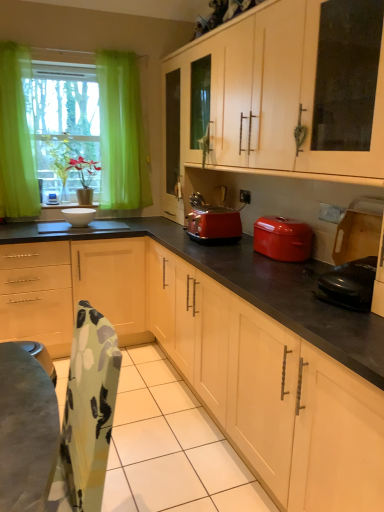
Question: In terms of height, does white glossy bowl at center, which is counted as the 1th appliance, starting from the back, look taller or shorter compared to white matte cabinet at upper center, which appears as the 1th cabinetry when viewed from the top?

Choices:
 (A) tall
 (B) short

Answer: (B)

Question: In the image, is white glossy bowl at center, which is counted as the 1th appliance, starting from the back, on the left side or the right side of white matte cabinet at upper center, the second cabinetry ordered from the bottom?

Choices:
 (A) right
 (B) left

Answer: (B)

Question: Considering the real-world distances, which object is farthest from the white matte cabinet at upper center, the second cabinetry ordered from the bottom?

Choices:
 (A) black glossy electric kettle at lower right, marked as the 2th appliance in a left-to-right arrangement
 (B) white glossy bowl at left
 (C) white glossy bowl at center, the first appliance when ordered from top to bottom
 (D) matte wood cabinets at center, acting as the second cabinetry starting from the top
 (E) matte red pot at right

Answer: (B)

Question: Which is farther from the white glossy bowl at center, positioned as the second appliance in right-to-left order?

Choices:
 (A) shiny red toaster at center
 (B) white matte cabinet at upper center, which appears as the 1th cabinetry when viewed from the top
 (C) green sheer curtain at left
 (D) matte wood cabinets at center, the 1th cabinetry when ordered from bottom to top
 (E) white glossy bowl at left

Answer: (B)